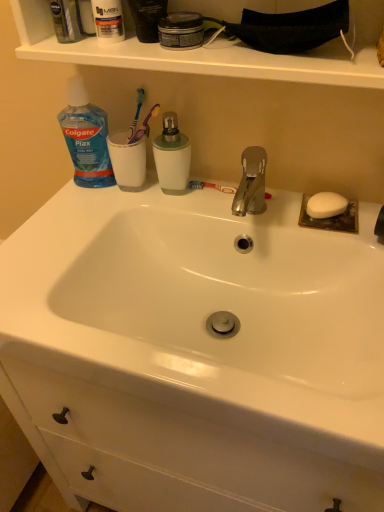
Question: Is white matte soap at right taller or shorter than clear plastic mouthwash at upper left, which is counted as the second mouthwash, starting from the right?

Choices:
 (A) tall
 (B) short

Answer: (B)

Question: Considering their positions, is white matte soap at right located in front of or behind clear plastic mouthwash at upper left, which is counted as the second mouthwash, starting from the right?

Choices:
 (A) front
 (B) behind

Answer: (B)

Question: Based on their relative distances, which object is nearer to the white glossy sink at center?

Choices:
 (A) clear plastic mouthwash at upper left, acting as the 1th mouthwash starting from the top
 (B) green matte mouthwash at center, positioned as the 2th mouthwash in top-to-bottom order
 (C) blue plastic toothbrush at upper center
 (D) white matte soap at right
 (E) blue translucent plastic bottle at upper left

Answer: (D)

Question: Estimate the real-world distances between objects in this image. Which object is closer to the green matte mouthwash at center, the first mouthwash in the bottom-to-top sequence?

Choices:
 (A) white matte soap at right
 (B) blue plastic toothbrush at upper center
 (C) blue translucent plastic bottle at upper left
 (D) white glossy sink at center
 (E) clear plastic mouthwash at upper left, the second mouthwash from the bottom

Answer: (B)